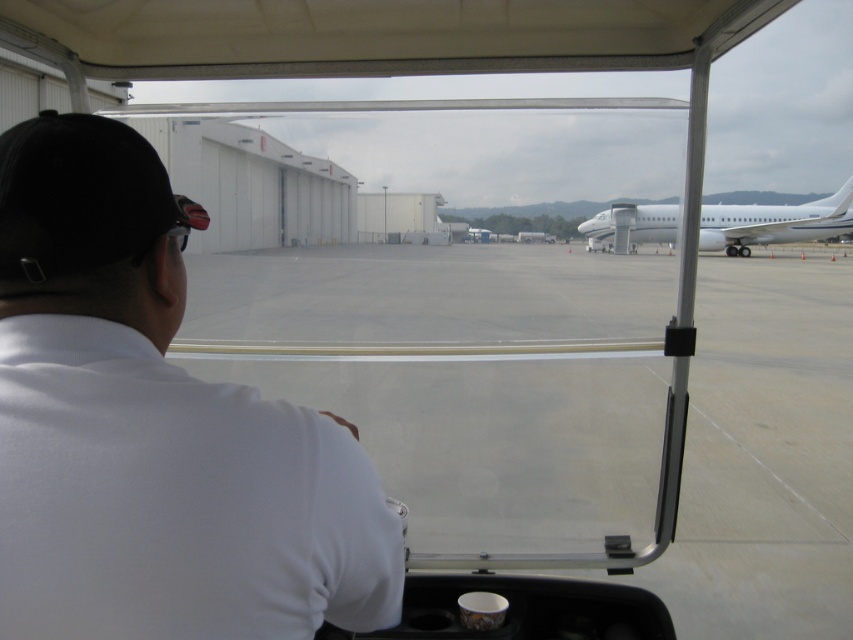
Question: Is white matte shirt at left in front of white glossy airplane at right?

Choices:
 (A) yes
 (B) no

Answer: (A)

Question: Which object is farther from the camera taking this photo?

Choices:
 (A) white matte shirt at left
 (B) white glossy airplane at right

Answer: (B)

Question: Is white matte shirt at left closer to the viewer compared to white glossy airplane at right?

Choices:
 (A) no
 (B) yes

Answer: (B)

Question: Among these points, which one is nearest to the camera?

Choices:
 (A) (732, 205)
 (B) (134, 172)

Answer: (B)

Question: Considering the relative positions of white matte shirt at left and white glossy airplane at right in the image provided, where is white matte shirt at left located with respect to white glossy airplane at right?

Choices:
 (A) above
 (B) below

Answer: (B)